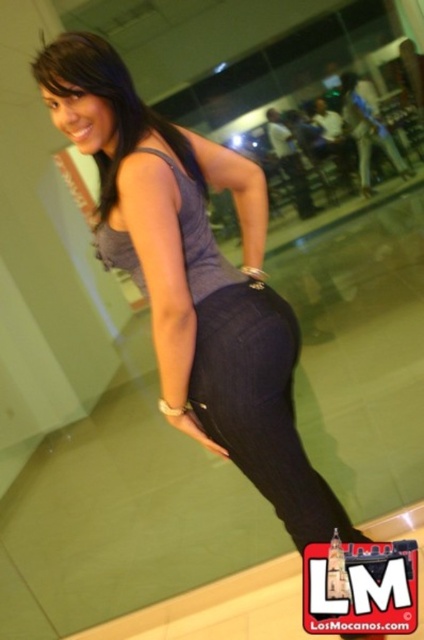
Question: Among these points, which one is nearest to the camera?

Choices:
 (A) (181, 156)
 (B) (306, 188)
 (C) (259, 426)
 (D) (114, 248)

Answer: (D)

Question: Which point is closer to the camera taking this photo?

Choices:
 (A) (237, 429)
 (B) (60, 68)
 (C) (208, 218)

Answer: (B)

Question: Is matte gray tank top at center to the right of matte gray tank top at upper center from the viewer's perspective?

Choices:
 (A) yes
 (B) no

Answer: (B)

Question: Does matte purple tank top at upper center come behind matte gray tank top at upper center?

Choices:
 (A) no
 (B) yes

Answer: (A)

Question: Based on their relative distances, which object is nearer to the matte purple tank top at upper center?

Choices:
 (A) matte gray tank top at upper center
 (B) dark blue denim jeans at center

Answer: (B)

Question: Does dark blue denim jeans at center have a greater width compared to matte gray tank top at center?

Choices:
 (A) yes
 (B) no

Answer: (A)